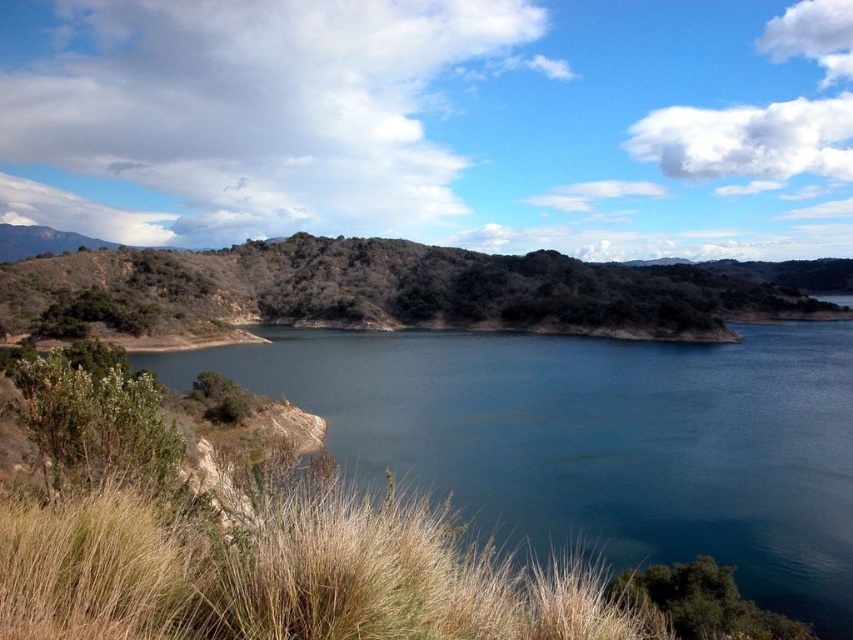
Question: Does dry grass at lower left lie in front of green textured hillside at center?

Choices:
 (A) yes
 (B) no

Answer: (A)

Question: Does blue water at center appear under green textured hillside at center?

Choices:
 (A) no
 (B) yes

Answer: (B)

Question: Observing the image, what is the correct spatial positioning of dry grass at lower left in reference to green textured hillside at center?

Choices:
 (A) below
 (B) above

Answer: (A)

Question: Which point is closer to the camera taking this photo?

Choices:
 (A) tap(73, 508)
 (B) tap(782, 456)

Answer: (A)

Question: Which is nearer to the green textured hillside at center?

Choices:
 (A) blue water at center
 (B) dry grass at lower left

Answer: (A)

Question: Which point appears farthest from the camera in this image?

Choices:
 (A) (572, 275)
 (B) (763, 349)

Answer: (A)